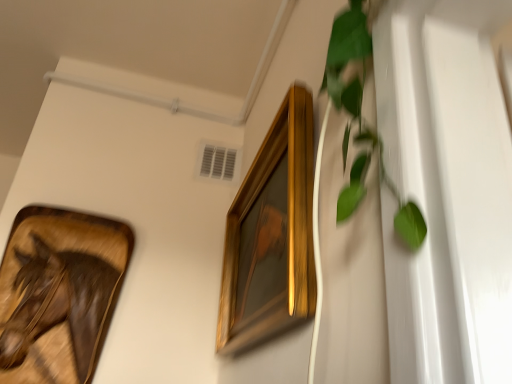
What do you see at coordinates (58, 293) in the screenshot? I see `wooden frame at left, which appears as the first picture frame when viewed from the left` at bounding box center [58, 293].

In order to face green leafy plant at right, should I rotate leftwards or rightwards?

Rotate right and turn 11.610 degrees.

I want to click on wooden frame at left, which appears as the first picture frame when viewed from the left, so click(x=58, y=293).

Is gold wooden picture frame at upper center, arranged as the first picture frame when viewed from the right, oriented towards wooden frame at left, which appears as the first picture frame when viewed from the left?

Yes, gold wooden picture frame at upper center, arranged as the first picture frame when viewed from the right, is facing wooden frame at left, which appears as the first picture frame when viewed from the left.

Which object is closer to the camera taking this photo, gold wooden picture frame at upper center, the second picture frame positioned from the left, or wooden frame at left, positioned as the 2th picture frame in right-to-left order?

gold wooden picture frame at upper center, the second picture frame positioned from the left, is more forward.

I want to click on picture frame below the gold wooden picture frame at upper center, the second picture frame positioned from the left (from a real-world perspective), so click(58, 293).

Can you confirm if wooden frame at left, which appears as the first picture frame when viewed from the left, is positioned to the left of gold wooden picture frame at upper center, the second picture frame positioned from the left?

Indeed, wooden frame at left, which appears as the first picture frame when viewed from the left, is positioned on the left side of gold wooden picture frame at upper center, the second picture frame positioned from the left.

Looking at this image, are wooden frame at left, positioned as the 2th picture frame in right-to-left order, and gold wooden picture frame at upper center, the second picture frame positioned from the left, making contact?

There is a gap between wooden frame at left, positioned as the 2th picture frame in right-to-left order, and gold wooden picture frame at upper center, the second picture frame positioned from the left.

Is gold wooden picture frame at upper center, arranged as the first picture frame when viewed from the right, at the back of wooden frame at left, positioned as the 2th picture frame in right-to-left order?

wooden frame at left, positioned as the 2th picture frame in right-to-left order, is not turned away from gold wooden picture frame at upper center, arranged as the first picture frame when viewed from the right.

Which point is more distant from viewer, (395, 193) or (52, 217)?

Point (52, 217)

Between green leafy plant at right and wooden frame at left, positioned as the 2th picture frame in right-to-left order, which one has smaller width?

green leafy plant at right is thinner.

Is wooden frame at left, which appears as the first picture frame when viewed from the left, at the back of green leafy plant at right?

No.

Measure the distance between green leafy plant at right and wooden frame at left, which appears as the first picture frame when viewed from the left.

They are 1.01 meters apart.

From a real-world perspective, is green leafy plant at right located beneath gold wooden picture frame at upper center, the second picture frame positioned from the left?

Actually, green leafy plant at right is physically above gold wooden picture frame at upper center, the second picture frame positioned from the left, in the real world.

Find the location of a particular element. The image size is (512, 384). vegetation above the gold wooden picture frame at upper center, the second picture frame positioned from the left (from a real-world perspective) is located at coordinates (362, 122).

Is green leafy plant at right taller or shorter than gold wooden picture frame at upper center, the second picture frame positioned from the left?

green leafy plant at right is shorter than gold wooden picture frame at upper center, the second picture frame positioned from the left.

Relative to gold wooden picture frame at upper center, the second picture frame positioned from the left, is green leafy plant at right in front or behind?

Visually, green leafy plant at right is located in front of gold wooden picture frame at upper center, the second picture frame positioned from the left.

Is point (306, 118) positioned after point (350, 86)?

Yes, it is.

From a real-world perspective, between gold wooden picture frame at upper center, the second picture frame positioned from the left, and green leafy plant at right, who is vertically higher?

In real-world perspective, green leafy plant at right is above.

From their relative heights in the image, would you say gold wooden picture frame at upper center, arranged as the first picture frame when viewed from the right, is taller or shorter than green leafy plant at right?

gold wooden picture frame at upper center, arranged as the first picture frame when viewed from the right, is taller than green leafy plant at right.

Who is taller, wooden frame at left, which appears as the first picture frame when viewed from the left, or green leafy plant at right?

wooden frame at left, which appears as the first picture frame when viewed from the left, is taller.

Is the position of wooden frame at left, positioned as the 2th picture frame in right-to-left order, less distant than that of green leafy plant at right?

No, it is behind green leafy plant at right.

Is green leafy plant at right completely or partially inside wooden frame at left, which appears as the first picture frame when viewed from the left?

No, green leafy plant at right is not inside wooden frame at left, which appears as the first picture frame when viewed from the left.

Is wooden frame at left, which appears as the first picture frame when viewed from the left, directly adjacent to green leafy plant at right?

No, wooden frame at left, which appears as the first picture frame when viewed from the left, is not beside green leafy plant at right.

The width and height of the screenshot is (512, 384). What are the coordinates of `picture frame that is above the wooden frame at left, which appears as the first picture frame when viewed from the left (from a real-world perspective)` in the screenshot? It's located at (271, 234).

Identify the location of picture frame directly beneath the gold wooden picture frame at upper center, the second picture frame positioned from the left (from a real-world perspective). This screenshot has width=512, height=384. (58, 293).

Considering their positions, is green leafy plant at right positioned further to wooden frame at left, which appears as the first picture frame when viewed from the left, than gold wooden picture frame at upper center, arranged as the first picture frame when viewed from the right?

Based on the image, green leafy plant at right appears to be further to wooden frame at left, which appears as the first picture frame when viewed from the left.

Looking at the image, which one is located further to green leafy plant at right, gold wooden picture frame at upper center, the second picture frame positioned from the left, or wooden frame at left, which appears as the first picture frame when viewed from the left?

wooden frame at left, which appears as the first picture frame when viewed from the left, is positioned further to the anchor green leafy plant at right.

Based on the photo, estimate the real-world distances between objects in this image. Which object is further from gold wooden picture frame at upper center, the second picture frame positioned from the left, wooden frame at left, positioned as the 2th picture frame in right-to-left order, or green leafy plant at right?

wooden frame at left, positioned as the 2th picture frame in right-to-left order, is positioned further to the anchor gold wooden picture frame at upper center, the second picture frame positioned from the left.

From the image, which object appears to be farther from green leafy plant at right, wooden frame at left, positioned as the 2th picture frame in right-to-left order, or gold wooden picture frame at upper center, arranged as the first picture frame when viewed from the right?

wooden frame at left, positioned as the 2th picture frame in right-to-left order, is further to green leafy plant at right.

From the image, which object appears to be nearer to wooden frame at left, positioned as the 2th picture frame in right-to-left order, gold wooden picture frame at upper center, the second picture frame positioned from the left, or green leafy plant at right?

Based on the image, gold wooden picture frame at upper center, the second picture frame positioned from the left, appears to be nearer to wooden frame at left, positioned as the 2th picture frame in right-to-left order.

Estimate the real-world distances between objects in this image. Which object is closer to gold wooden picture frame at upper center, the second picture frame positioned from the left, green leafy plant at right or wooden frame at left, positioned as the 2th picture frame in right-to-left order?

The object closer to gold wooden picture frame at upper center, the second picture frame positioned from the left, is green leafy plant at right.

The image size is (512, 384). What are the coordinates of `picture frame situated between wooden frame at left, which appears as the first picture frame when viewed from the left, and green leafy plant at right from left to right` in the screenshot? It's located at (271, 234).